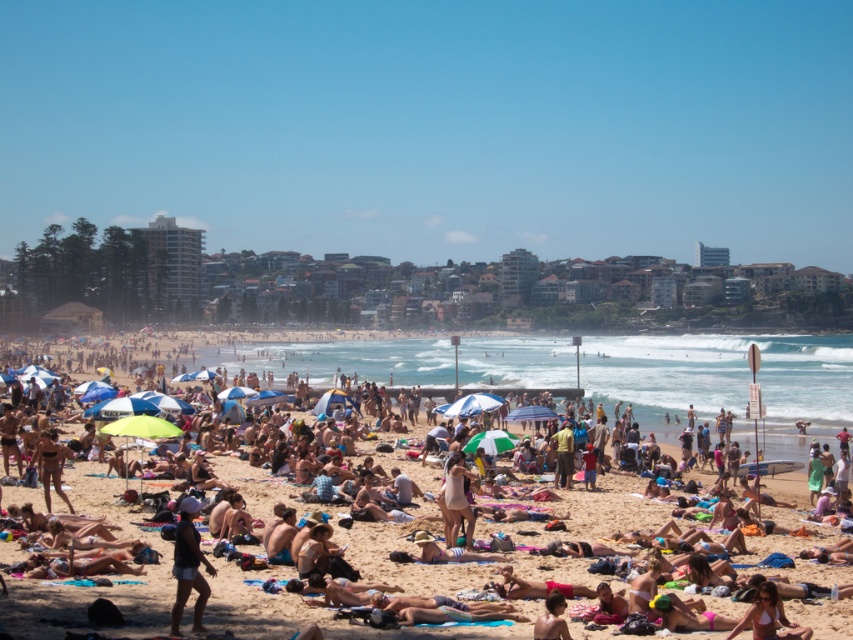
Is tan skin person at center wider than matte black shorts at lower center?

Correct, the width of tan skin person at center exceeds that of matte black shorts at lower center.

Who is higher up, tan skin person at center or matte black shorts at lower center?

tan skin person at center

Who is more distant from viewer, (x=851, y=417) or (x=196, y=544)?

The point (x=851, y=417) is behind.

I want to click on tan skin person at center, so click(x=726, y=387).

Who is lower down, matte black shorts at lower center or smooth tan skin at lower center?

smooth tan skin at lower center is lower down.

Who is higher up, matte black shorts at lower center or smooth tan skin at lower center?

matte black shorts at lower center

Locate an element on the screen. matte black shorts at lower center is located at coordinates (189, 566).

Between matte white bikini at center and smooth tan skin at lower center, which one has less height?

With less height is smooth tan skin at lower center.

Does matte white bikini at center have a lesser height compared to smooth tan skin at lower center?

Incorrect, matte white bikini at center's height does not fall short of smooth tan skin at lower center's.

Is point (463, 465) positioned before point (550, 604)?

No, it is not.

Identify the location of matte white bikini at center. (457, 497).